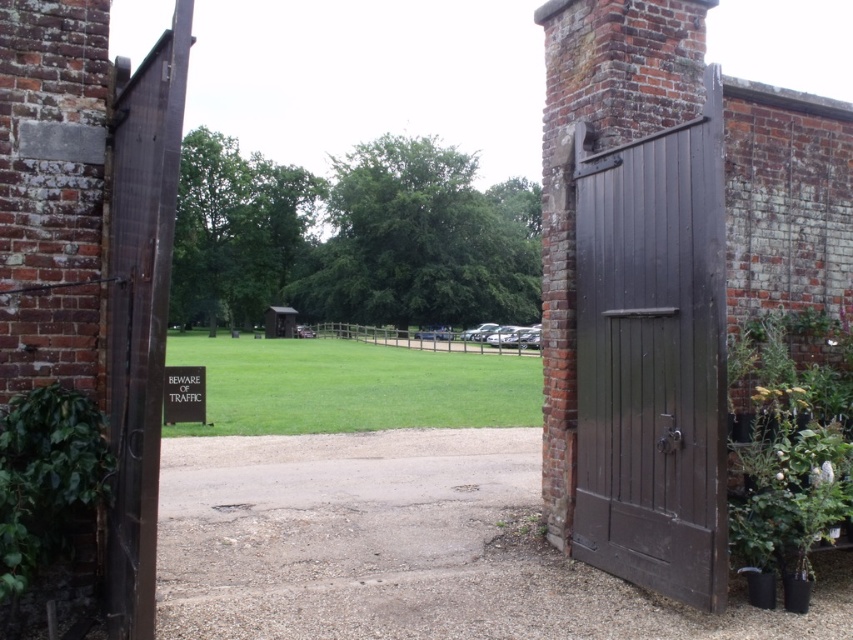
Question: Among these objects, which one is farthest from the camera?

Choices:
 (A) matte dark wood door at right
 (B) green leafy plant at right
 (C) green grass at center
 (D) green leafy plant at left

Answer: (C)

Question: Which object is positioned farthest from the green leafy plant at right?

Choices:
 (A) matte dark wood door at right
 (B) green leafy plant at left

Answer: (B)

Question: In this image, where is matte dark wood door at right located relative to green leafy plant at right?

Choices:
 (A) above
 (B) below

Answer: (A)

Question: Which object appears closest to the camera in this image?

Choices:
 (A) green leafy plant at right
 (B) matte dark wood door at right
 (C) green leafy plant at left

Answer: (C)

Question: Is matte dark wood door at right below green leafy plant at right?

Choices:
 (A) yes
 (B) no

Answer: (B)

Question: Does green leafy plant at right have a smaller size compared to green leafy plant at left?

Choices:
 (A) no
 (B) yes

Answer: (A)